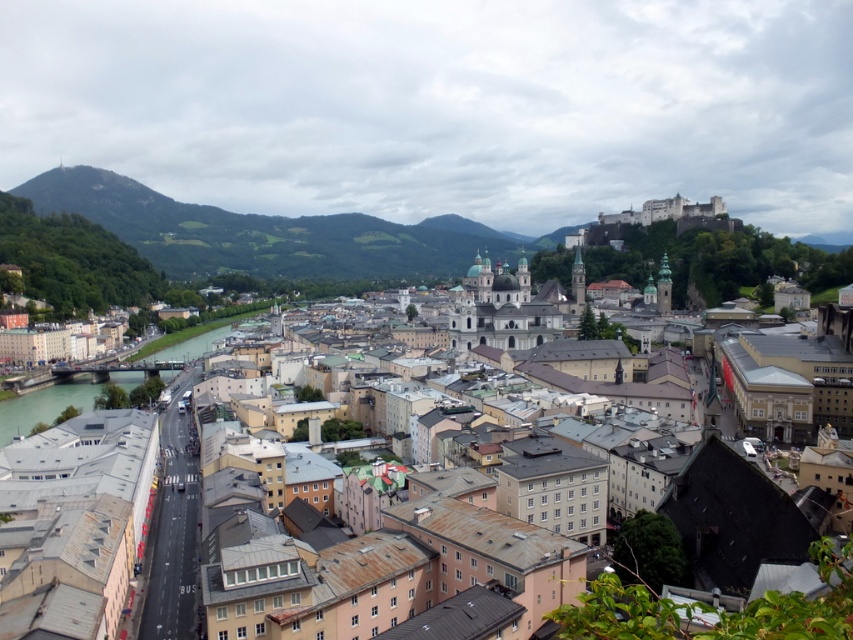
Consider the image. Between brown/rooftops town at center and green stone river at lower left, which one has more height?

With more height is brown/rooftops town at center.

Is brown/rooftops town at center smaller than green stone river at lower left?

Incorrect, brown/rooftops town at center is not smaller in size than green stone river at lower left.

Which is behind, point (384, 520) or point (86, 394)?

Positioned behind is point (86, 394).

At what (x,y) coordinates should I click in order to perform the action: click on brown/rooftops town at center. Please return your answer as a coordinate pair (x, y). This screenshot has width=853, height=640. Looking at the image, I should click on (712, 609).

Who is positioned more to the right, green grassy hill at left or green stone river at lower left?

green stone river at lower left

Who is shorter, green grassy hill at left or green stone river at lower left?

green stone river at lower left

Find the location of a particular element. Image resolution: width=853 pixels, height=640 pixels. green grassy hill at left is located at coordinates (270, 234).

Does brown/rooftops town at center lie behind green grassy hill at left?

No, brown/rooftops town at center is closer to the viewer.

Based on the photo, does brown/rooftops town at center have a larger size compared to green grassy hill at left?

No, brown/rooftops town at center is not bigger than green grassy hill at left.

What do you see at coordinates (712, 609) in the screenshot? I see `brown/rooftops town at center` at bounding box center [712, 609].

Where is `brown/rooftops town at center`? Image resolution: width=853 pixels, height=640 pixels. brown/rooftops town at center is located at coordinates tap(712, 609).